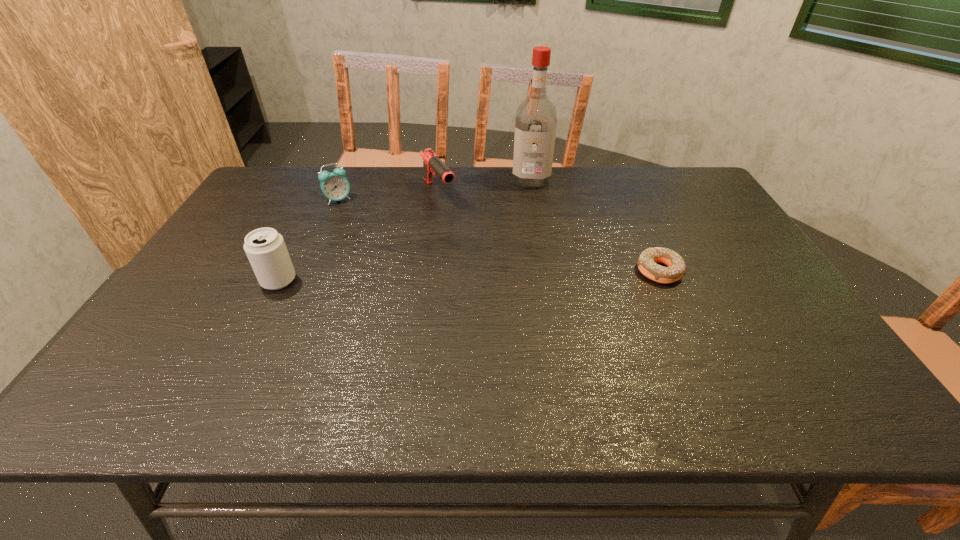
The height and width of the screenshot is (540, 960). Identify the location of blank space located 0.130m at the aiming end of the third object from right to left. (463, 229).

Locate an element on the screen. This screenshot has height=540, width=960. free location located 0.280m at the aiming end of the third object from right to left is located at coordinates (486, 257).

Locate an element on the screen. The height and width of the screenshot is (540, 960). free spot located on the front-facing side of the fourth object from left to right is located at coordinates (529, 232).

Identify the location of vacant space located 0.210m on the front-facing side of the fourth object from left to right. (529, 226).

Locate an element on the screen. vacant space located 0.280m on the front-facing side of the fourth object from left to right is located at coordinates (528, 240).

You are a GUI agent. You are given a task and a screenshot of the screen. Output one action in this format:
    pyautogui.click(x=<x>, y=<y>)
    Task: Click on the vacant region located on the face of the alarm clock
    This screenshot has width=960, height=540.
    Given the screenshot: What is the action you would take?
    pyautogui.click(x=356, y=214)

I want to click on vacant space located 0.330m on the face of the alarm clock, so click(x=401, y=254).

At what (x,y) coordinates should I click in order to perform the action: click on free spot located 0.180m on the face of the alarm clock. Please return your answer as a coordinate pair (x, y). The image size is (960, 540). Looking at the image, I should click on (374, 230).

Where is `gun present at the far edge`? gun present at the far edge is located at coordinates click(431, 162).

Find the location of a particular element. liquor positioned at the far edge is located at coordinates (536, 118).